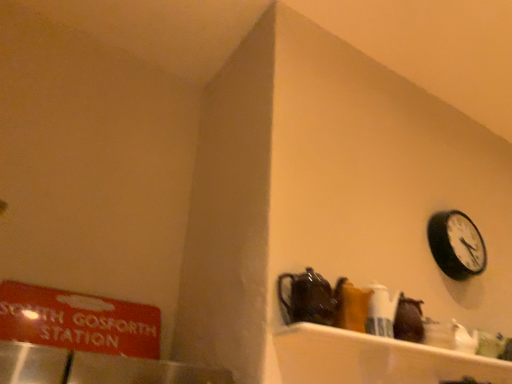
Question: Based on their sizes in the image, would you say black matte wall clock at upper right is bigger or smaller than red matte sign at left?

Choices:
 (A) big
 (B) small

Answer: (B)

Question: Is black matte wall clock at upper right taller or shorter than red matte sign at left?

Choices:
 (A) short
 (B) tall

Answer: (B)

Question: Based on their relative distances, which object is farther from the shiny dark brown teapot at center?

Choices:
 (A) black matte wall clock at upper right
 (B) red matte sign at left

Answer: (A)

Question: Based on their relative distances, which object is nearer to the shiny dark brown teapot at center?

Choices:
 (A) red matte sign at left
 (B) black matte wall clock at upper right

Answer: (A)